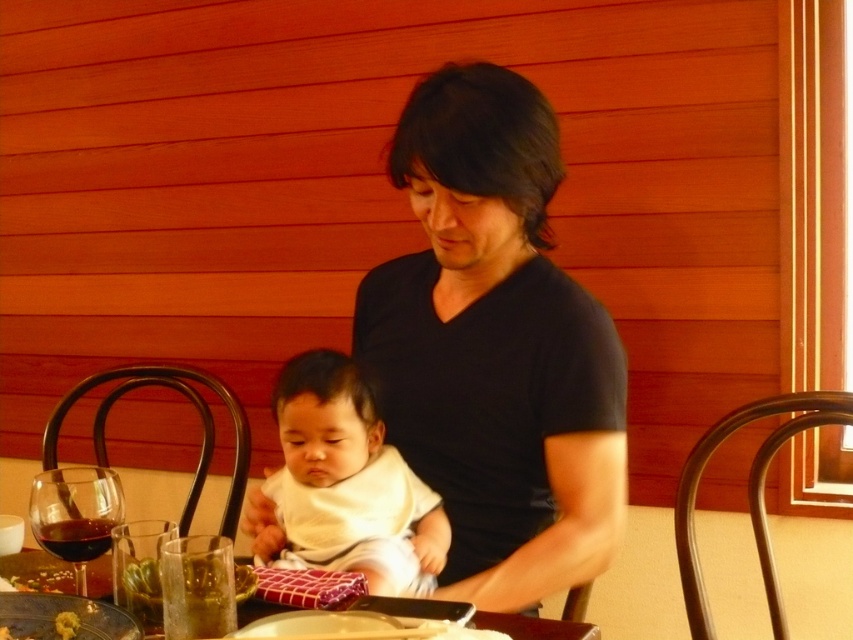
Question: Is white soft baby at center thinner than translucent glass wine at lower left?

Choices:
 (A) yes
 (B) no

Answer: (B)

Question: Considering the real-world distances, which object is closest to the white soft baby at center?

Choices:
 (A) dark red glass at lower left
 (B) translucent glass wine at lower left
 (C) black matte shirt at center
 (D) wooden table at center

Answer: (C)

Question: Is black matte shirt at center thinner than dark red glass at lower left?

Choices:
 (A) no
 (B) yes

Answer: (A)

Question: Estimate the real-world distances between objects in this image. Which object is farther from the dark red glass at lower left?

Choices:
 (A) wooden table at center
 (B) translucent glass wine at lower left
 (C) white soft baby at center

Answer: (C)

Question: Estimate the real-world distances between objects in this image. Which object is closer to the white soft baby at center?

Choices:
 (A) dark red glass at lower left
 (B) black matte shirt at center

Answer: (B)

Question: Can you confirm if white soft baby at center is smaller than translucent glass wine at lower left?

Choices:
 (A) yes
 (B) no

Answer: (B)